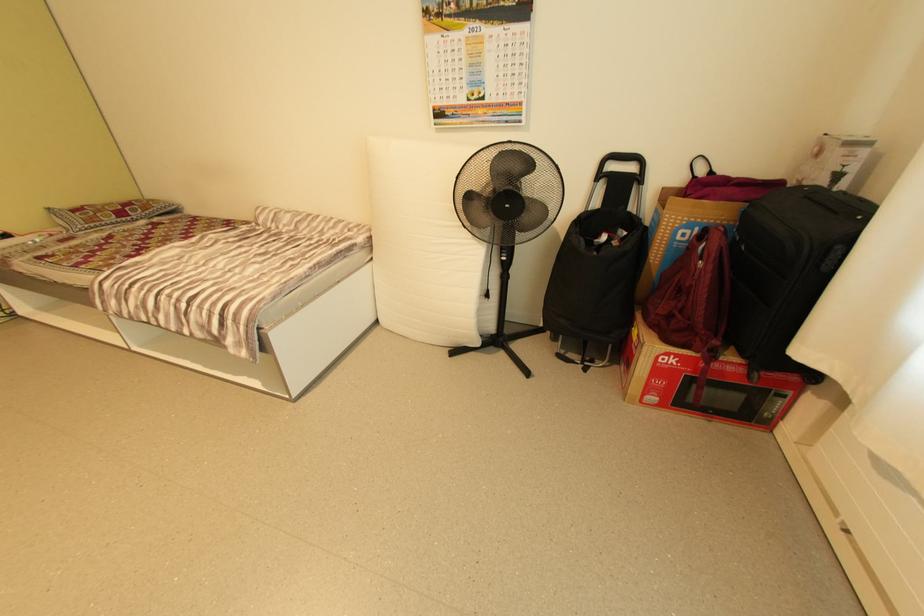
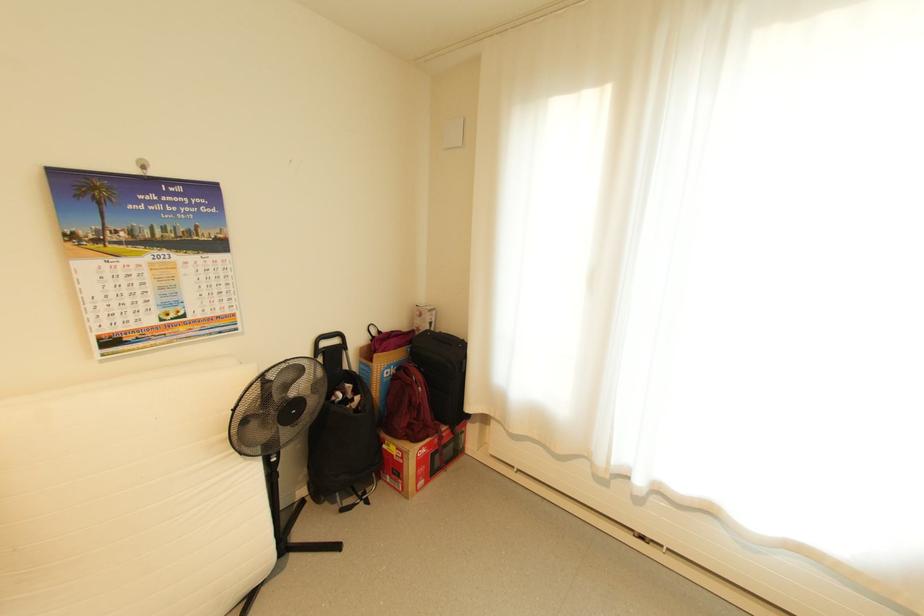
Find the pixel in the second image that matches point 813,185 in the first image.

(429, 330)